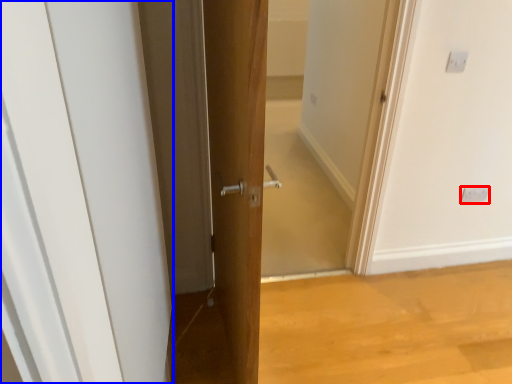
Question: Among these objects, which one is farthest to the camera, electric outlet (highlighted by a red box) or door (highlighted by a blue box)?

Choices:
 (A) electric outlet
 (B) door

Answer: (A)